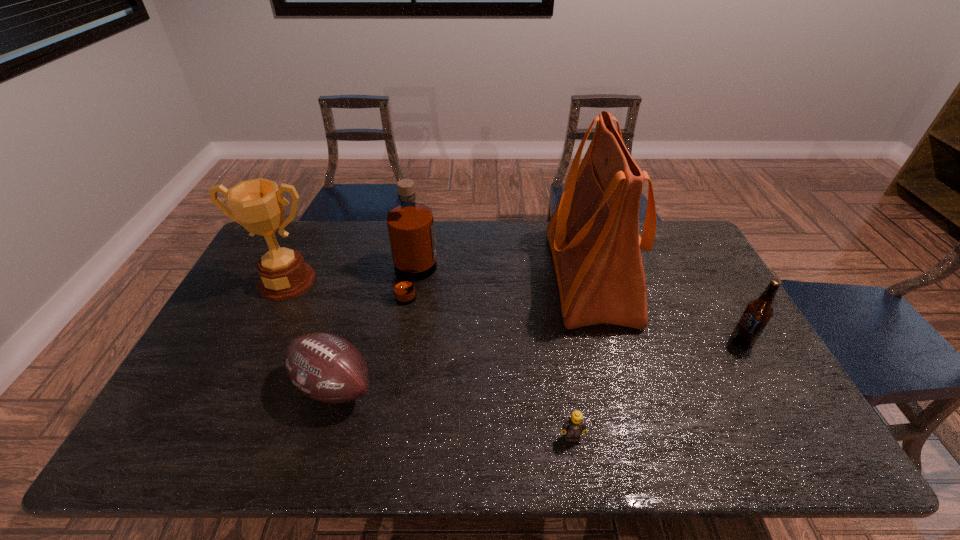
Where is `vacant point located between the tallest object and the leftmost object`? Image resolution: width=960 pixels, height=540 pixels. vacant point located between the tallest object and the leftmost object is located at coordinates click(439, 278).

Where is `vacant area that lies between the liquor and the football (American)`? vacant area that lies between the liquor and the football (American) is located at coordinates (373, 332).

Identify the location of free area in between the fourth tallest object and the fifth tallest object. (537, 364).

Where is `vacant area that lies between the nearest object and the third nearest object`? Image resolution: width=960 pixels, height=540 pixels. vacant area that lies between the nearest object and the third nearest object is located at coordinates (657, 389).

Where is `unoccupied position between the award and the rightmost object`? The image size is (960, 540). unoccupied position between the award and the rightmost object is located at coordinates pyautogui.click(x=514, y=312).

Identify which object is the closest to the shopping bag. Please provide its 2D coordinates. Your answer should be formatted as a tuple, i.e. [(x, y)], where the tuple contains the x and y coordinates of a point satisfying the conditions above.

[(758, 312)]

Select which object appears as the fourth closest to the liquor. Please provide its 2D coordinates. Your answer should be formatted as a tuple, i.e. [(x, y)], where the tuple contains the x and y coordinates of a point satisfying the conditions above.

[(574, 426)]

Locate an element on the screen. This screenshot has height=540, width=960. free space that satisfies the following two spatial constraints: 1. on the front-facing side of the leftmost object; 2. on the left side of the football (American) is located at coordinates (236, 386).

What are the coordinates of `free location that satisfies the following two spatial constraints: 1. on the front pocket of the shopping bag; 2. on the front-facing side of the award` in the screenshot? It's located at (591, 281).

Where is `blank area in the image that satisfies the following two spatial constraints: 1. on the front pocket of the shopping bag; 2. in front of the Lego`? blank area in the image that satisfies the following two spatial constraints: 1. on the front pocket of the shopping bag; 2. in front of the Lego is located at coordinates pyautogui.click(x=635, y=437).